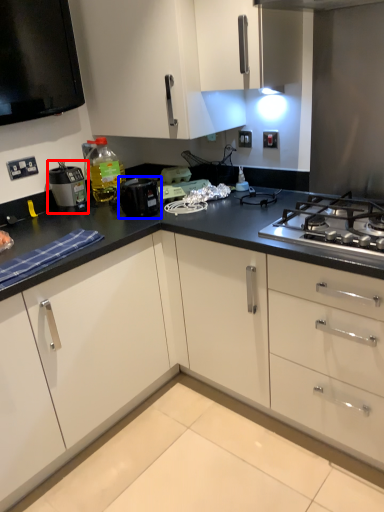
Question: Which point is closer to the camera, home appliance (highlighted by a red box) or kitchen appliance (highlighted by a blue box)?

Choices:
 (A) home appliance
 (B) kitchen appliance

Answer: (B)